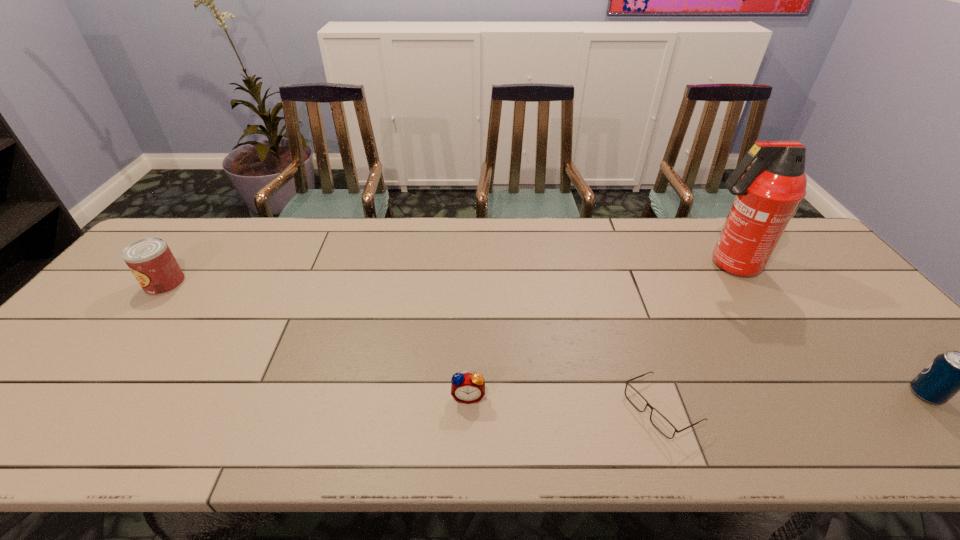
Where is `object positioned at the right edge`? object positioned at the right edge is located at coordinates (x=950, y=372).

This screenshot has height=540, width=960. In order to click on vacant space at the far edge of the desktop in this screenshot , I will do point(606,245).

Locate an element on the screen. The height and width of the screenshot is (540, 960). vacant space at the near edge of the desktop is located at coordinates (361, 434).

In the image, there is a desktop. At what (x,y) coordinates should I click in order to perform the action: click on vacant space at the left edge. Please return your answer as a coordinate pair (x, y). Image resolution: width=960 pixels, height=540 pixels. Looking at the image, I should click on (87, 381).

Find the location of a particular element. vacant space at the right edge of the desktop is located at coordinates click(806, 284).

The image size is (960, 540). I want to click on vacant region at the near right corner of the desktop, so click(x=909, y=440).

You are a GUI agent. You are given a task and a screenshot of the screen. Output one action in this format:
    pyautogui.click(x=<x>, y=<y>)
    Task: Click on the vacant space that's between the soda can and the fourth tallest object
    Image resolution: width=960 pixels, height=540 pixels.
    Given the screenshot: What is the action you would take?
    pyautogui.click(x=697, y=395)

You are a GUI agent. You are given a task and a screenshot of the screen. Output one action in this format:
    pyautogui.click(x=<x>, y=<y>)
    Task: Click on the free spot between the leftmost object and the tallest object
    The height and width of the screenshot is (540, 960).
    Given the screenshot: What is the action you would take?
    pyautogui.click(x=447, y=274)

You are a GUI agent. You are given a task and a screenshot of the screen. Output one action in this format:
    pyautogui.click(x=<x>, y=<y>)
    Task: Click on the free point between the fourth object from left to right and the soda can
    The height and width of the screenshot is (540, 960).
    Given the screenshot: What is the action you would take?
    pyautogui.click(x=827, y=329)

The image size is (960, 540). Identify the location of free spot between the leftmost object and the soda can. (545, 339).